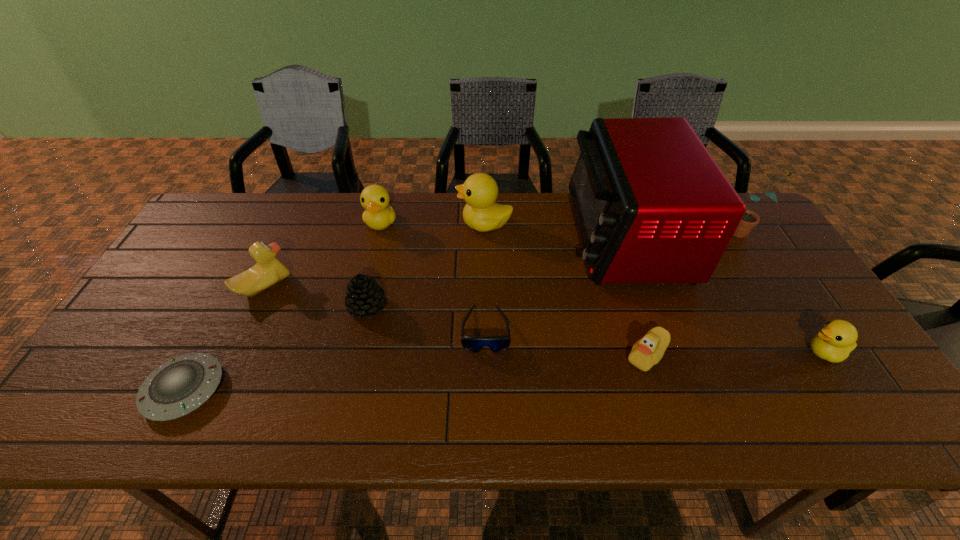
This screenshot has height=540, width=960. What are the coordinates of `vacant space situated on the flower of the ninth shortest object` in the screenshot? It's located at (701, 232).

I want to click on vacant space located 0.140m on the flower of the ninth shortest object, so click(683, 232).

In order to click on vacant area located on the flower of the ninth shortest object in this screenshot , I will do `click(666, 232)`.

Where is `vacant area situated on the face of the biggest yellow duck`? This screenshot has width=960, height=540. vacant area situated on the face of the biggest yellow duck is located at coordinates (348, 224).

Where is `free space located on the face of the biggest yellow duck`? free space located on the face of the biggest yellow duck is located at coordinates (395, 224).

Locate an element on the screen. This screenshot has width=960, height=540. free space located on the face of the biggest yellow duck is located at coordinates (392, 224).

Find the location of a particular element. This screenshot has width=960, height=540. vacant region located 0.290m on the face of the leftmost yellow duck is located at coordinates (360, 308).

Image resolution: width=960 pixels, height=540 pixels. Identify the location of vacant space located at the beak of the third farthest duck. (357, 286).

This screenshot has width=960, height=540. What are the coordinates of `vacant space located at the narrow end of the pinecone` in the screenshot? It's located at (488, 307).

Find the location of a particular element. This screenshot has width=960, height=540. vacant space located 0.080m on the face of the rightmost yellow duck is located at coordinates [x=771, y=353].